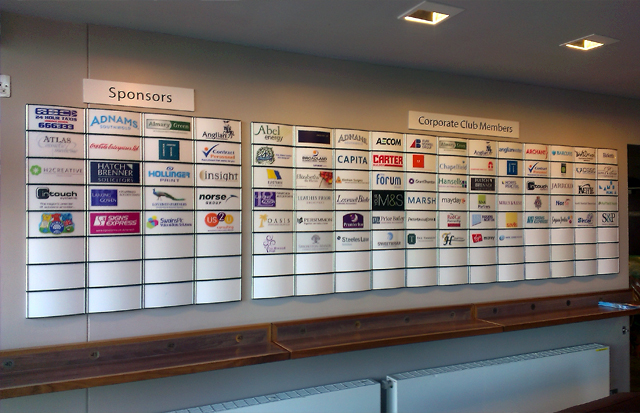
Where is `radiators`? This screenshot has width=640, height=413. radiators is located at coordinates (425, 406), (300, 406).